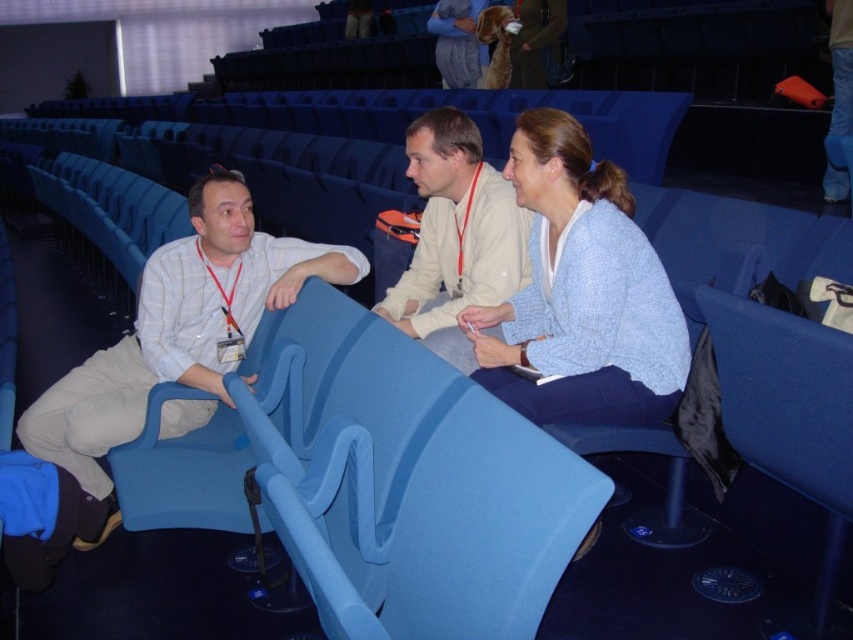
Can you confirm if light blue knit sweater at center is bigger than white striped shirt at left?

Actually, light blue knit sweater at center might be smaller than white striped shirt at left.

Does light blue knit sweater at center have a lesser height compared to white striped shirt at left?

Yes, light blue knit sweater at center is shorter than white striped shirt at left.

You are a GUI agent. You are given a task and a screenshot of the screen. Output one action in this format:
    pyautogui.click(x=<x>, y=<y>)
    Task: Click on the light blue knit sweater at center
    The image size is (853, 640).
    Given the screenshot: What is the action you would take?
    pyautogui.click(x=579, y=292)

You are a GUI agent. You are given a task and a screenshot of the screen. Output one action in this format:
    pyautogui.click(x=<x>, y=<y>)
    Task: Click on the light blue knit sweater at center
    The height and width of the screenshot is (640, 853).
    Given the screenshot: What is the action you would take?
    click(x=579, y=292)

Is the position of white striped shirt at left less distant than that of light beige shirt at center?

Yes, white striped shirt at left is in front of light beige shirt at center.

Describe the element at coordinates (178, 332) in the screenshot. I see `white striped shirt at left` at that location.

The height and width of the screenshot is (640, 853). In order to click on white striped shirt at left in this screenshot , I will do `click(178, 332)`.

Measure the distance between light blue knit sweater at center and light beige shirt at center.

light blue knit sweater at center is 12.38 inches from light beige shirt at center.

Which is behind, point (521, 202) or point (456, 116)?

The point (456, 116) is behind.

The width and height of the screenshot is (853, 640). Find the location of `light blue knit sweater at center`. light blue knit sweater at center is located at coordinates click(579, 292).